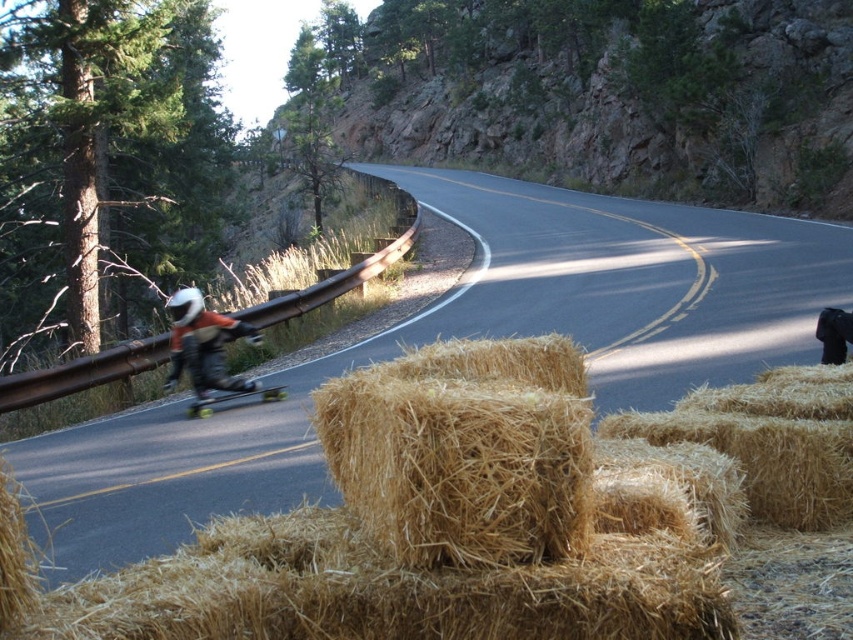
Can you confirm if golden straw bale at center is positioned to the left of matte black helmet at left?

In fact, golden straw bale at center is to the right of matte black helmet at left.

Is golden straw bale at center positioned behind matte black helmet at left?

No.

What do you see at coordinates (496, 509) in the screenshot?
I see `golden straw bale at center` at bounding box center [496, 509].

Identify the location of golden straw bale at center. (496, 509).

Can you confirm if brown straw bale at center is positioned to the right of matte black helmet at left?

Yes, brown straw bale at center is to the right of matte black helmet at left.

Does brown straw bale at center have a larger size compared to matte black helmet at left?

Yes.

Which is in front, point (444, 381) or point (172, 324)?

Positioned in front is point (444, 381).

This screenshot has width=853, height=640. I want to click on brown straw bale at center, so click(x=463, y=449).

Which is behind, point (466, 385) or point (259, 394)?

The point (259, 394) is behind.

Who is more forward, (357, 440) or (207, 406)?

Point (357, 440) is more forward.

Does point (468, 512) come closer to viewer compared to point (279, 390)?

Yes, point (468, 512) is closer to viewer.

Locate an element on the screen. brown straw bale at center is located at coordinates click(463, 449).